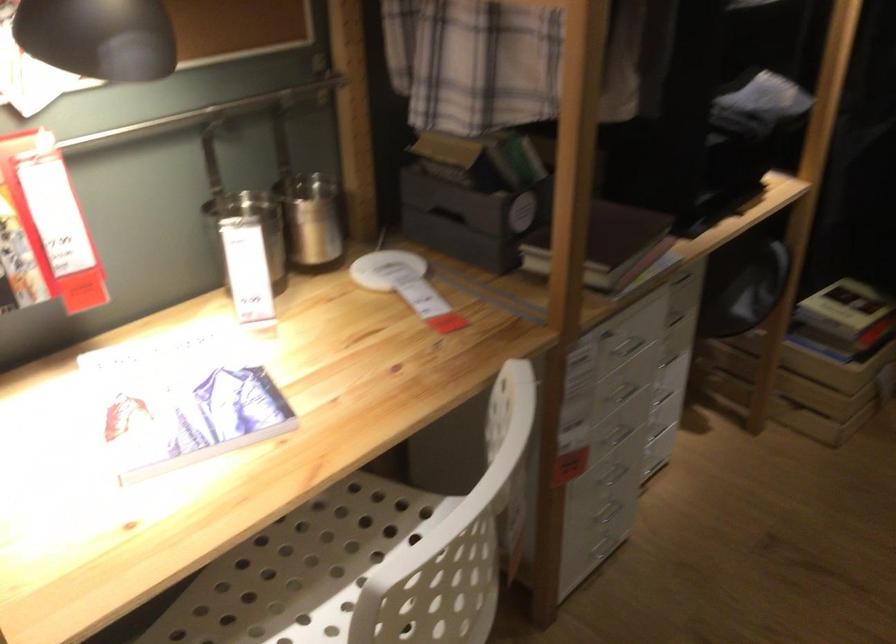
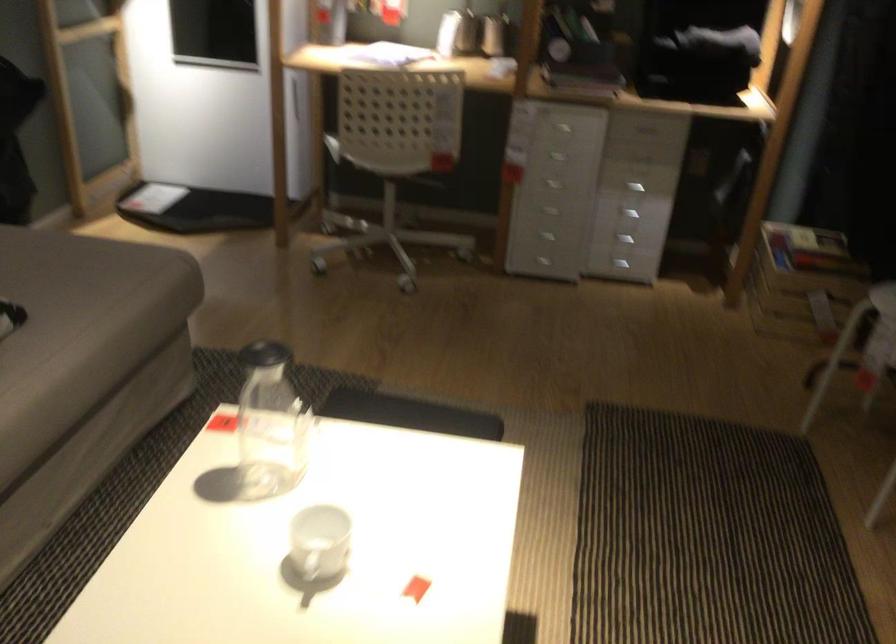
The point at (683,413) is marked in the first image. Where is the corresponding point in the second image?

(627, 214)